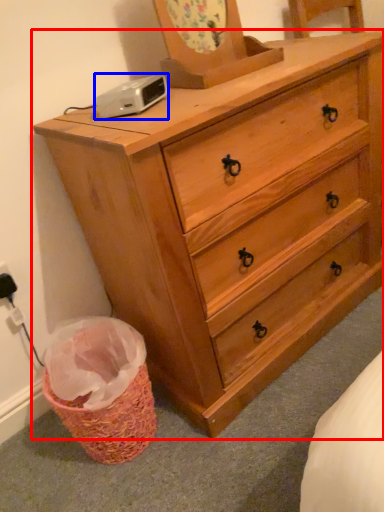
Question: Which object is further to the camera taking this photo, chest of drawers (highlighted by a red box) or gadget (highlighted by a blue box)?

Choices:
 (A) chest of drawers
 (B) gadget

Answer: (B)